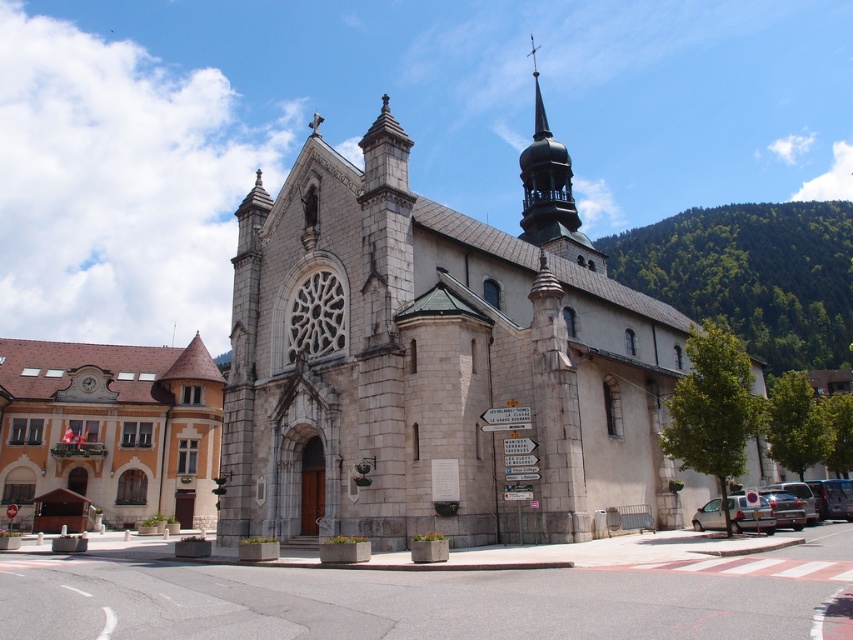
Who is lower down, gold textured spire at upper right or metallic silver car at lower right?

metallic silver car at lower right is below.

Between point (531, 45) and point (775, 525), which one is positioned behind?

The point (531, 45) is more distant.

Locate an element on the screen. This screenshot has width=853, height=640. gold textured spire at upper right is located at coordinates (546, 182).

Can you confirm if matte stone church at center is positioned to the right of silver metallic car at lower right?

Incorrect, matte stone church at center is not on the right side of silver metallic car at lower right.

Can you confirm if matte stone church at center is positioned to the left of silver metallic car at lower right?

Correct, you'll find matte stone church at center to the left of silver metallic car at lower right.

This screenshot has height=640, width=853. I want to click on matte stone church at center, so click(x=111, y=426).

Identify the location of matte stone church at center. Image resolution: width=853 pixels, height=640 pixels. (111, 426).

Is the position of stone church at center less distant than that of silver metallic car at lower right?

Yes.

Is point (428, 476) in front of point (735, 522)?

Yes.

Measure the distance between point (309,182) and camera.

Answer: 65.47 meters

The height and width of the screenshot is (640, 853). I want to click on stone church at center, so click(432, 368).